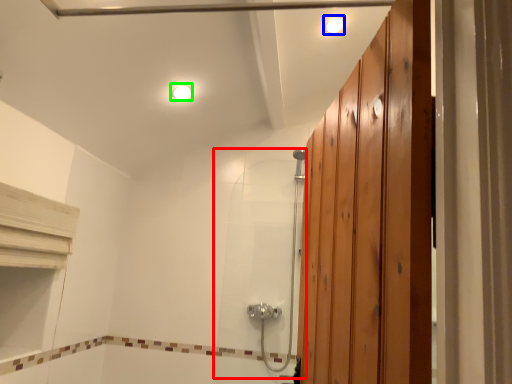
Question: Estimate the real-world distances between objects in this image. Which object is closer to shower door (highlighted by a red box), light fixture (highlighted by a blue box) or light fixture (highlighted by a green box)?

Choices:
 (A) light fixture
 (B) light fixture

Answer: (B)